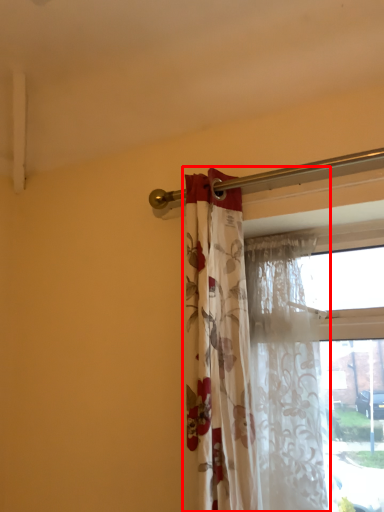
Question: From the image's perspective, where is curtain (annotated by the red box) located relative to curtain?

Choices:
 (A) below
 (B) above

Answer: (B)